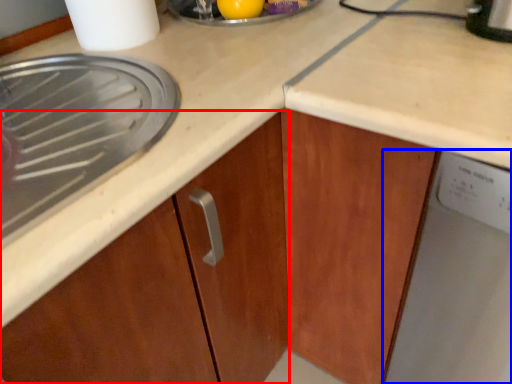
Question: Which object is further to the camera taking this photo, cabinetry (highlighted by a red box) or home appliance (highlighted by a blue box)?

Choices:
 (A) cabinetry
 (B) home appliance

Answer: (A)